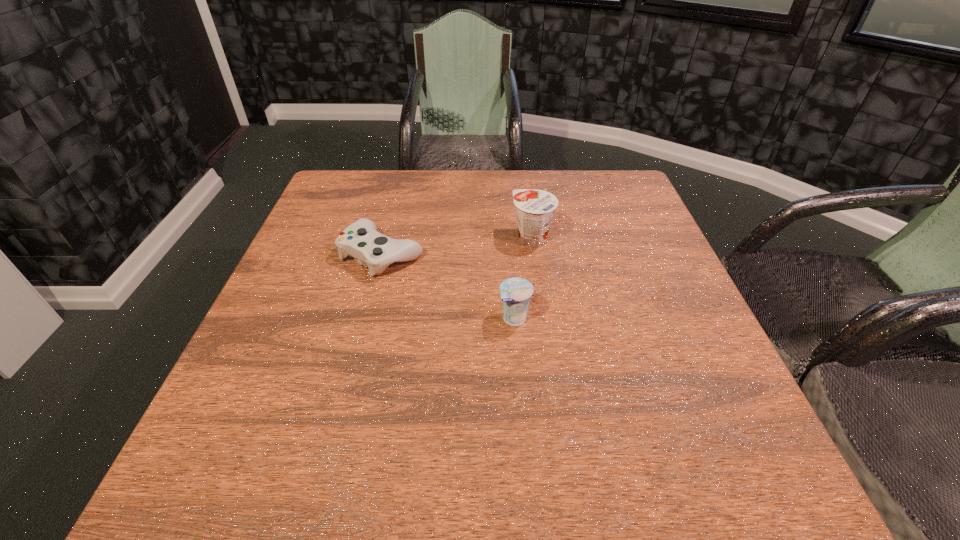
I want to click on vacant space at the far edge of the desktop, so click(415, 199).

The height and width of the screenshot is (540, 960). I want to click on blank area at the near edge, so (x=659, y=457).

Find the location of a particular element. The width and height of the screenshot is (960, 540). blank area at the left edge is located at coordinates [296, 402].

In the image, there is a desktop. Identify the location of free space at the right edge. (673, 429).

This screenshot has height=540, width=960. I want to click on vacant space at the near left corner of the desktop, so [282, 457].

Identify the location of vacant space at the far right corner. Image resolution: width=960 pixels, height=540 pixels. (609, 185).

Where is `vacant region at the near right corner`? Image resolution: width=960 pixels, height=540 pixels. vacant region at the near right corner is located at coordinates (728, 465).

Where is `free spot between the farther yogurt and the leftmost object`? The height and width of the screenshot is (540, 960). free spot between the farther yogurt and the leftmost object is located at coordinates (457, 246).

Where is `vacant area between the second shortest object and the leftmost object`? The width and height of the screenshot is (960, 540). vacant area between the second shortest object and the leftmost object is located at coordinates 448,286.

Locate an element on the screen. Image resolution: width=960 pixels, height=540 pixels. unoccupied area between the nearest object and the tallest object is located at coordinates (523, 279).